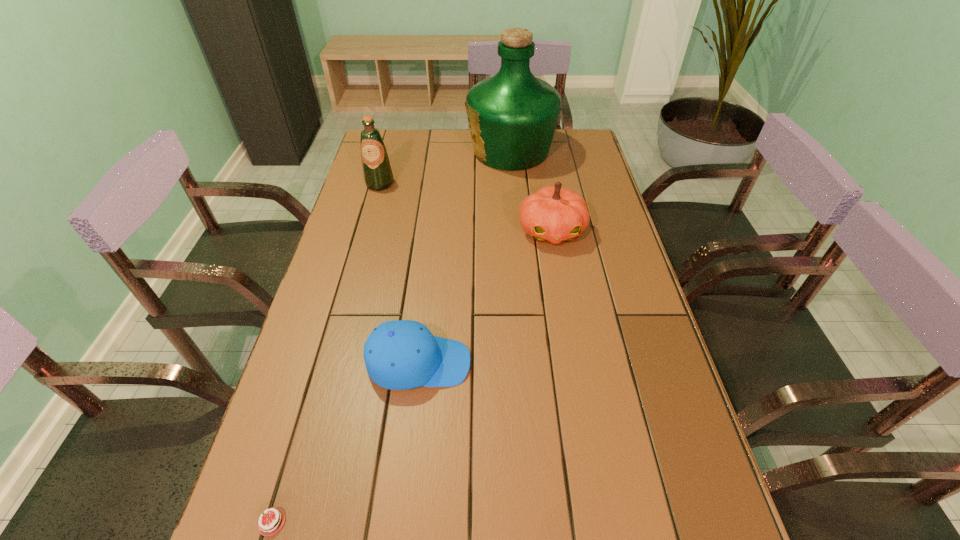
You are a GUI agent. You are given a task and a screenshot of the screen. Output one action in this format:
    pyautogui.click(x=<x>, y=<y>)
    Task: Click on the free space located on the front-facing side of the pumpkin
    
    Given the screenshot: What is the action you would take?
    pos(571,344)

This screenshot has width=960, height=540. I want to click on vacant space located 0.110m on the front-facing side of the fourth tallest object, so click(x=518, y=363).

The image size is (960, 540). Find the location of `object that is at the far edge`. object that is at the far edge is located at coordinates tap(512, 116).

You are a GUI agent. You are given a task and a screenshot of the screen. Output one action in this format:
    pyautogui.click(x=<x>, y=<y>)
    Task: Click on the object that is at the left edge
    Image resolution: width=960 pixels, height=540 pixels.
    Given the screenshot: What is the action you would take?
    pyautogui.click(x=377, y=172)

Image resolution: width=960 pixels, height=540 pixels. I want to click on liquor that is at the right edge, so click(512, 116).

You are a GUI agent. You are given a task and a screenshot of the screen. Output one action in this format:
    pyautogui.click(x=<x>, y=<y>)
    Task: Click on the pumpkin located at the right edge
    The height and width of the screenshot is (540, 960).
    Given the screenshot: What is the action you would take?
    pyautogui.click(x=552, y=214)

Where is `object that is at the far right corner`? The width and height of the screenshot is (960, 540). object that is at the far right corner is located at coordinates (512, 116).

In the image, there is a desktop. Where is `vacant space at the far edge`? The width and height of the screenshot is (960, 540). vacant space at the far edge is located at coordinates (420, 132).

Find the location of a particular element. The height and width of the screenshot is (540, 960). free location at the left edge of the desktop is located at coordinates 345,321.

In order to click on free space at the right edge of the desktop in this screenshot , I will do `click(722, 535)`.